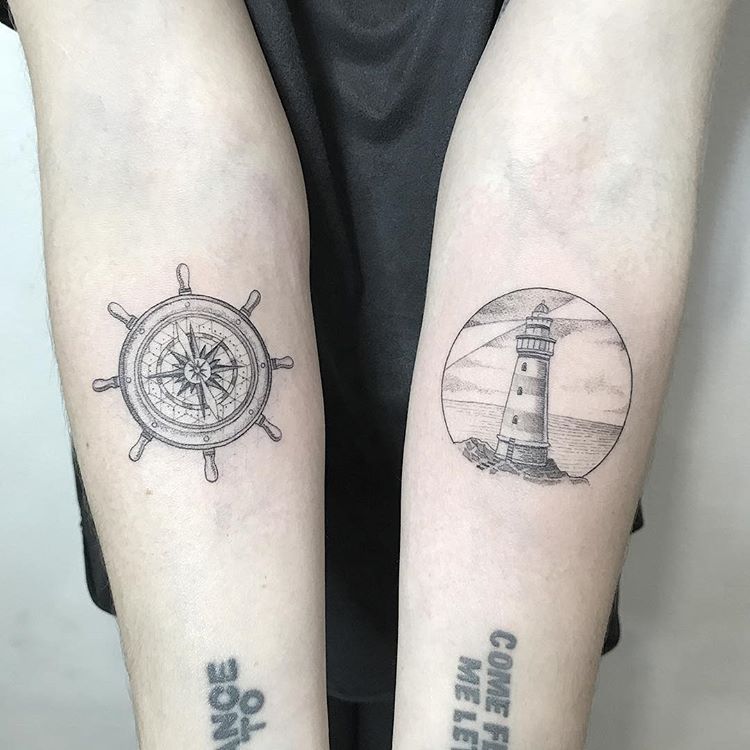
You are a GUI agent. You are given a task and a screenshot of the screen. Output one action in this format:
    pyautogui.click(x=<x>, y=<y>)
    Task: Click on the wall
    The width and height of the screenshot is (750, 750).
    Given the screenshot: What is the action you would take?
    pyautogui.click(x=714, y=230), pyautogui.click(x=726, y=675), pyautogui.click(x=70, y=700), pyautogui.click(x=19, y=160)